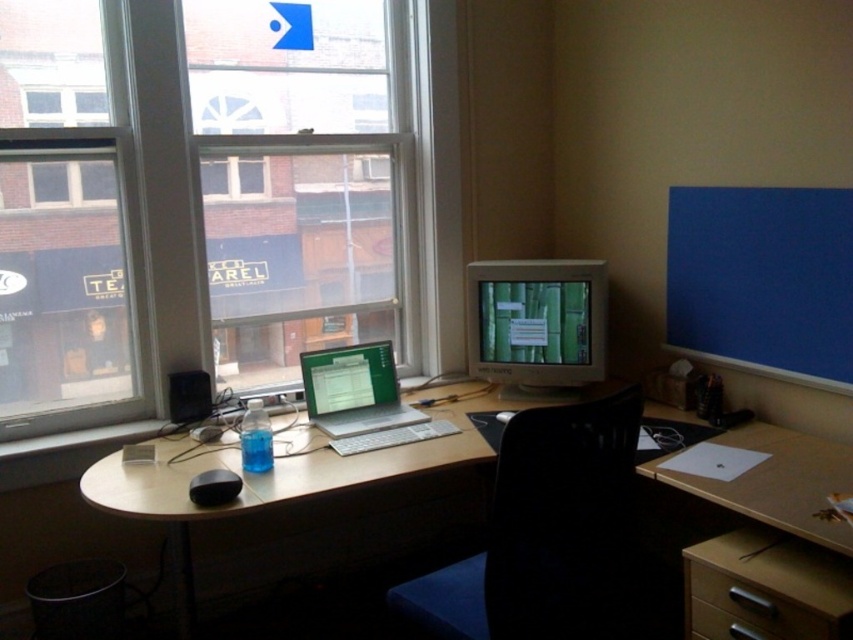
In the scene shown: Is black plastic chair at center further to the viewer compared to light brown wooden desk at center?

No, black plastic chair at center is closer to the viewer.

In the scene shown: Which is above, black plastic chair at center or light brown wooden desk at center?

Positioned higher is light brown wooden desk at center.

What do you see at coordinates (544, 532) in the screenshot? I see `black plastic chair at center` at bounding box center [544, 532].

Where is `black plastic chair at center`? Image resolution: width=853 pixels, height=640 pixels. black plastic chair at center is located at coordinates (544, 532).

Does transparent glass window at upper left appear over satin silver laptop at center?

Yes.

Can you confirm if transparent glass window at upper left is positioned to the left of satin silver laptop at center?

Correct, you'll find transparent glass window at upper left to the left of satin silver laptop at center.

Who is more forward, (144, 218) or (375, 410)?

Point (144, 218) is more forward.

This screenshot has width=853, height=640. What are the coordinates of `transparent glass window at upper left` in the screenshot? It's located at (200, 202).

Measure the distance from transparent glass window at upper left to black plastic chair at center.

transparent glass window at upper left and black plastic chair at center are 4.93 feet apart.

Who is lower down, transparent glass window at upper left or black plastic chair at center?

black plastic chair at center is below.

Which is behind, point (357, 196) or point (512, 488)?

Point (357, 196)

Identify the location of transparent glass window at upper left. (200, 202).